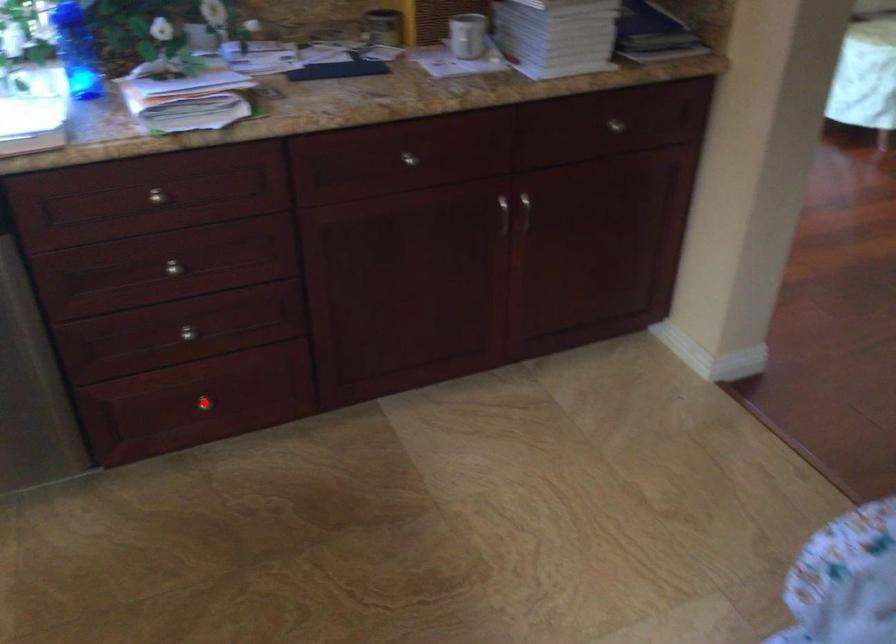
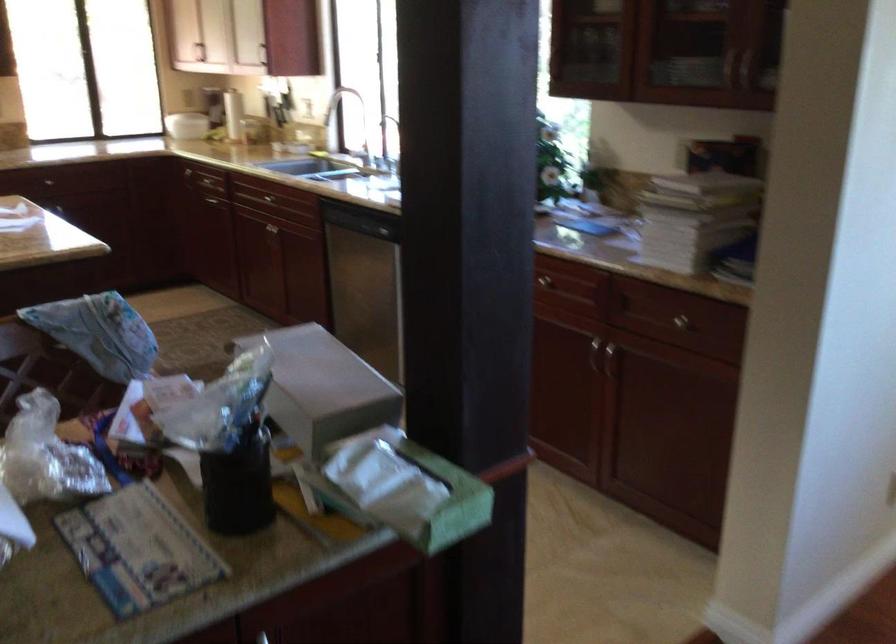
Question: I am providing you with two images of the same scene from different viewpoints. A red point is marked on the first image. Is the red point's position out of view in image 2?

Choices:
 (A) Yes
 (B) No

Answer: (A)